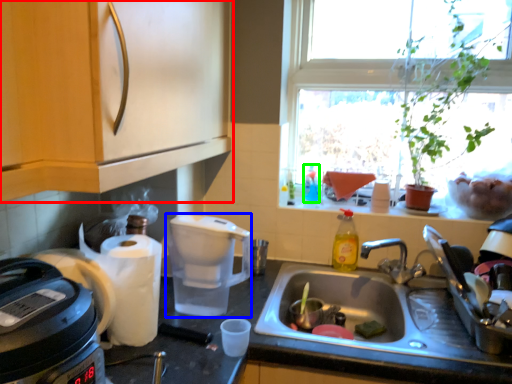
Question: Which is farther away from cabinetry (highlighted by a red box)? coffeepot (highlighted by a blue box) or bottle (highlighted by a green box)?

Choices:
 (A) coffeepot
 (B) bottle

Answer: (B)